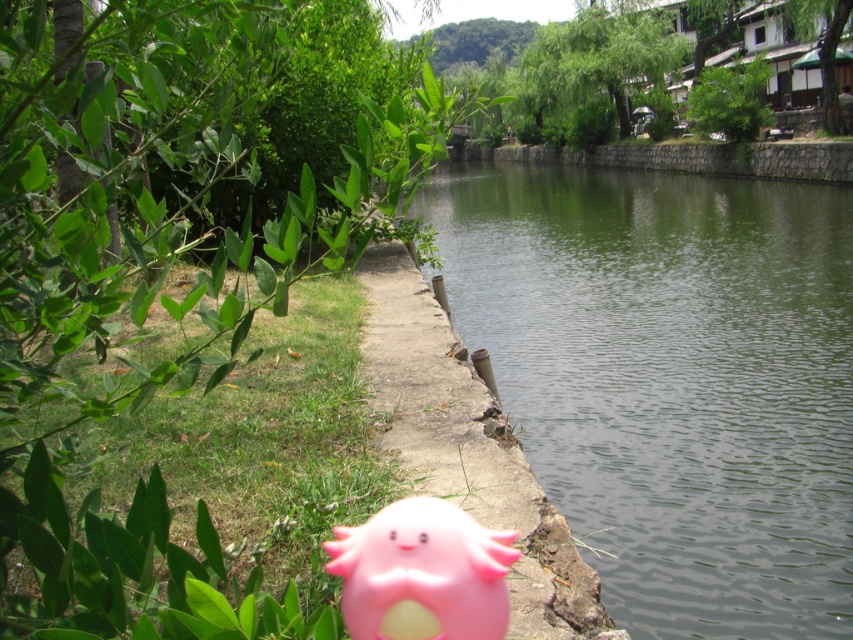
You are a small dog playing near the concrete at center and the pink rubber toy at lower center. Which object is taller from your perspective?

The pink rubber toy at lower center is taller than the concrete at center, so from the small dog perspective, the pink rubber toy at lower center appears taller.

You are a pedestrian walking along the riverside path. You notice the green stone river at center and the concrete at center. Which surface is higher in elevation?

The green stone river at center is positioned over concrete at center, so it is higher in elevation than the concrete at center.

You are a dog owner walking your pet along the riverside path. You notice the concrete at center and the pink rubber toy at lower center. Which object is closer to the ground?

The concrete at center is located below the pink rubber toy at lower center, so the concrete at center is closer to the ground.